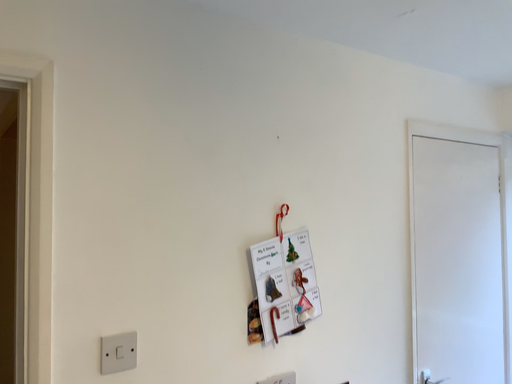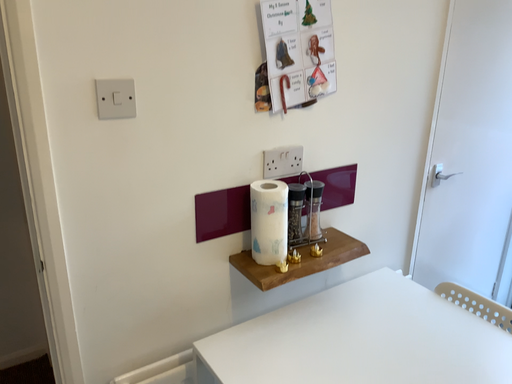
Question: Which way did the camera rotate in the video?

Choices:
 (A) rotated downward
 (B) rotated upward

Answer: (A)